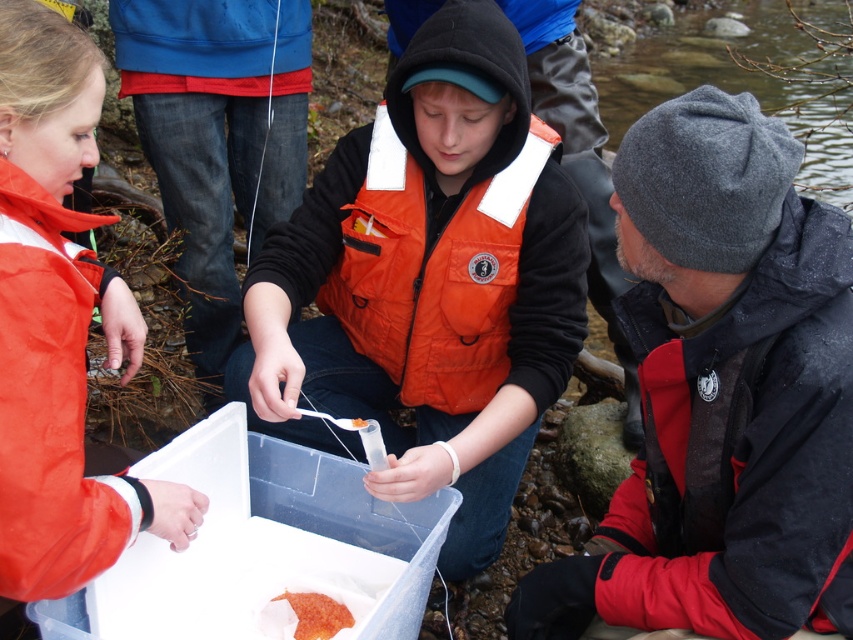
Who is positioned more to the right, orange quilted life jacket at center or orange matte food at center?

orange quilted life jacket at center

Who is more distant from viewer, (x=473, y=232) or (x=312, y=595)?

Point (x=473, y=232)

In order to click on orange quilted life jacket at center in this screenshot , I will do `click(433, 273)`.

This screenshot has height=640, width=853. I want to click on orange life vest at center, so click(721, 394).

Consider the image. Is orange life vest at center below orange gelatinous substance at center?

Yes, orange life vest at center is below orange gelatinous substance at center.

Where is `orange life vest at center`? The image size is (853, 640). orange life vest at center is located at coordinates (721, 394).

Does orange fabric vest at center come behind orange quilted life jacket at center?

That is False.

Image resolution: width=853 pixels, height=640 pixels. I want to click on orange fabric vest at center, so click(428, 284).

This screenshot has height=640, width=853. In order to click on orange fabric vest at center in this screenshot , I will do `click(428, 284)`.